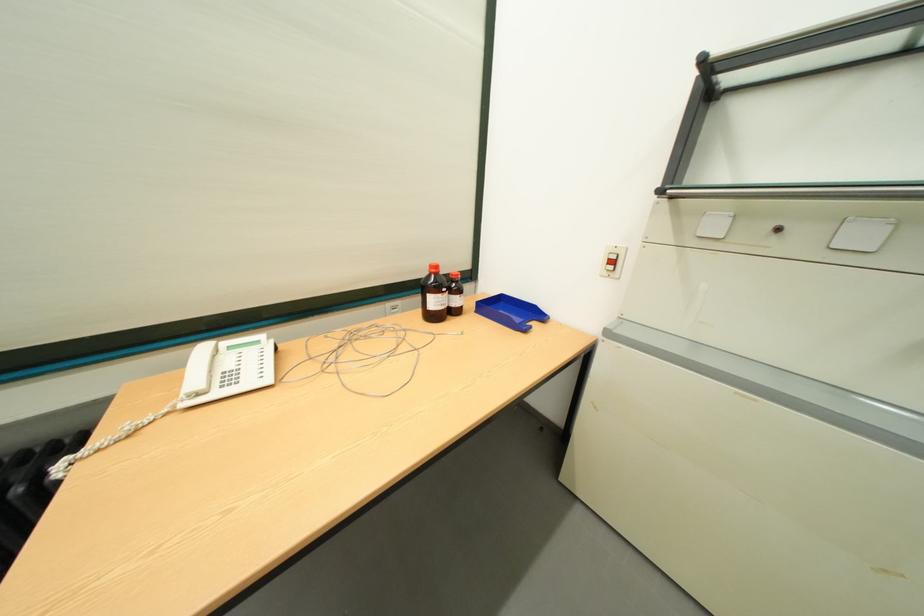
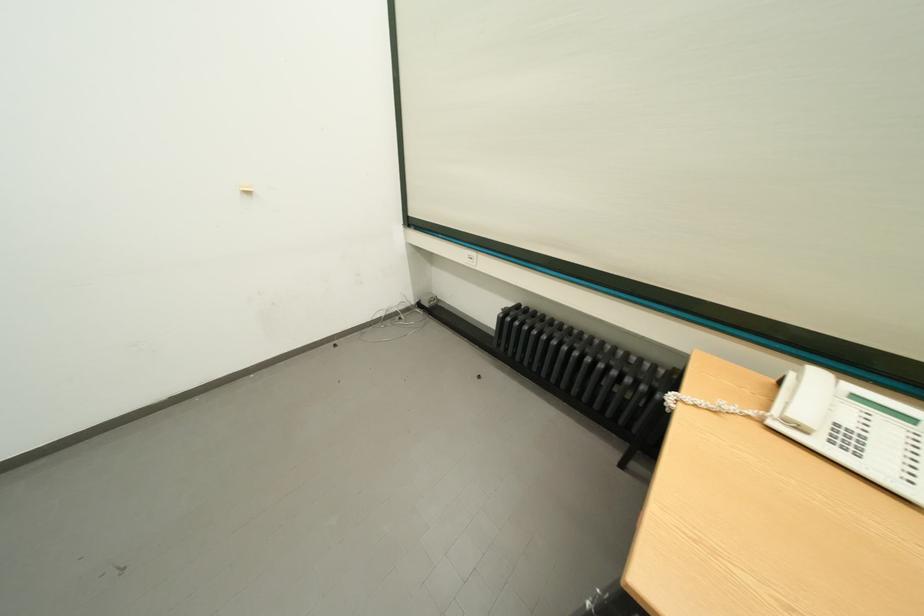
How did the camera likely rotate?

The camera rotated toward left-down.